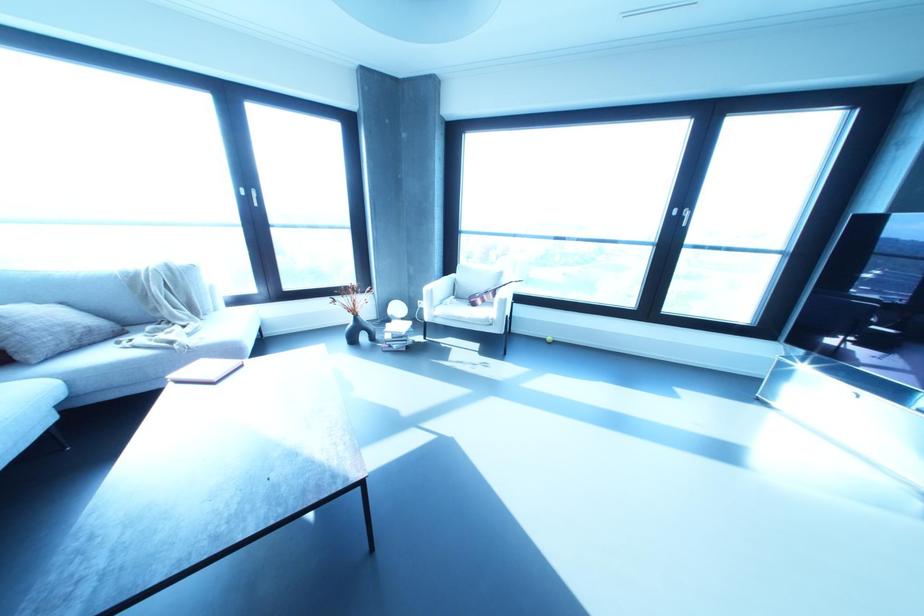
This screenshot has width=924, height=616. Describe the element at coordinates (146, 338) in the screenshot. I see `the light gray sofa sitting surface` at that location.